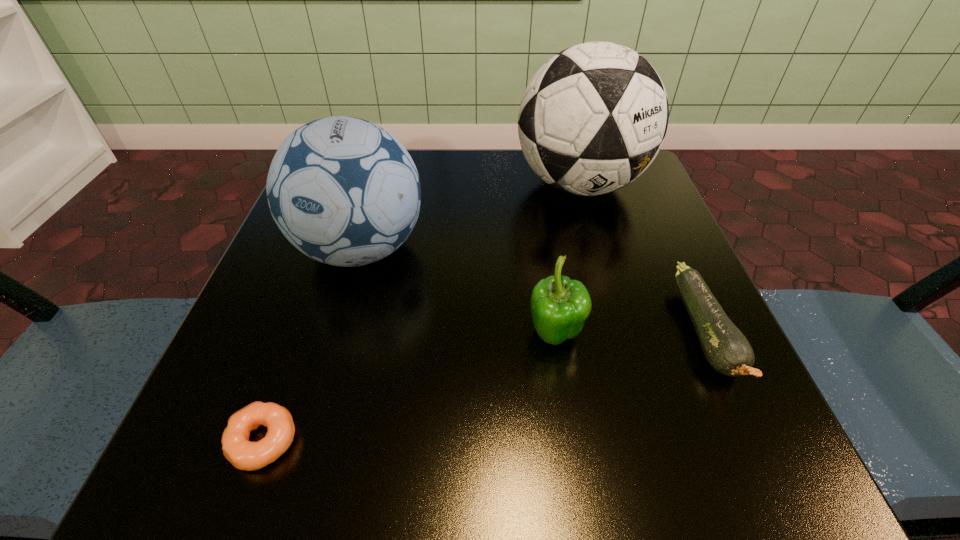
Where is `free spot located on the back of the nearest object`? The width and height of the screenshot is (960, 540). free spot located on the back of the nearest object is located at coordinates (308, 316).

At what (x,y) coordinates should I click in order to perform the action: click on object that is at the near edge. Please return your answer as a coordinate pair (x, y). Image resolution: width=960 pixels, height=540 pixels. Looking at the image, I should click on (243, 454).

At what (x,y) coordinates should I click in order to perform the action: click on soccer ball positioned at the left edge. Please return your answer as a coordinate pair (x, y). This screenshot has height=540, width=960. Looking at the image, I should click on (344, 191).

You are a GUI agent. You are given a task and a screenshot of the screen. Output one action in this format:
    pyautogui.click(x=<x>, y=<y>)
    Task: Click on the doughnut situated at the left edge
    
    Given the screenshot: What is the action you would take?
    pyautogui.click(x=243, y=454)

You are a GUI agent. You are given a task and a screenshot of the screen. Output one action in this format:
    pyautogui.click(x=<x>, y=<y>)
    Task: Click on the soccer ball positioned at the right edge
    The image size is (960, 540).
    Given the screenshot: What is the action you would take?
    pyautogui.click(x=592, y=119)

Locate an element on the screen. The height and width of the screenshot is (540, 960). zucchini at the right edge is located at coordinates (727, 350).

Where is `object present at the far left corner`? This screenshot has height=540, width=960. object present at the far left corner is located at coordinates (344, 191).

Where is `object situated at the near left corner`? object situated at the near left corner is located at coordinates (243, 454).

In order to click on object that is at the far right corner in this screenshot , I will do `click(592, 119)`.

You are a GUI agent. You are given a task and a screenshot of the screen. Output one action in this format:
    pyautogui.click(x=<x>, y=<y>)
    Task: Click on the vacant region at the far edge of the desktop
    Image resolution: width=960 pixels, height=540 pixels.
    Given the screenshot: What is the action you would take?
    pyautogui.click(x=445, y=186)